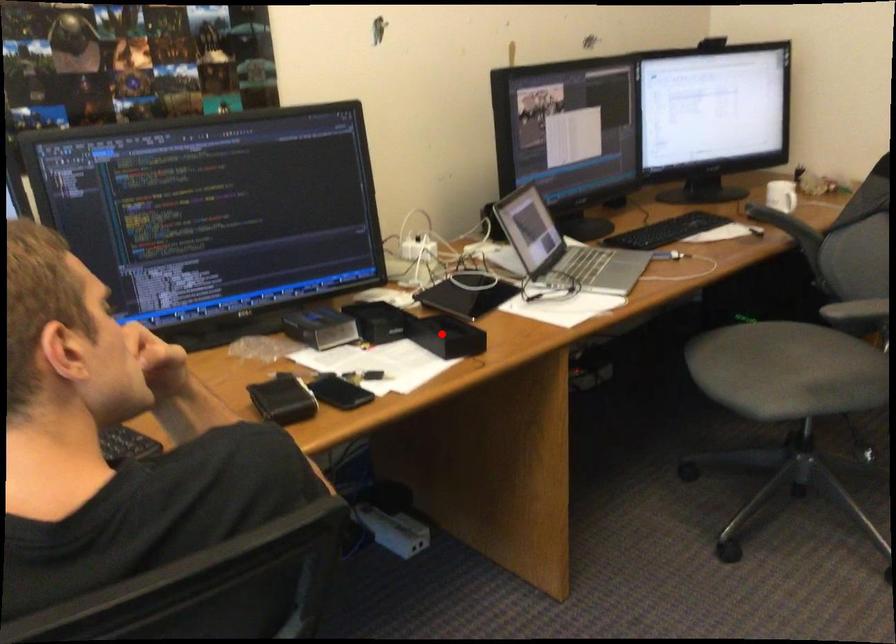
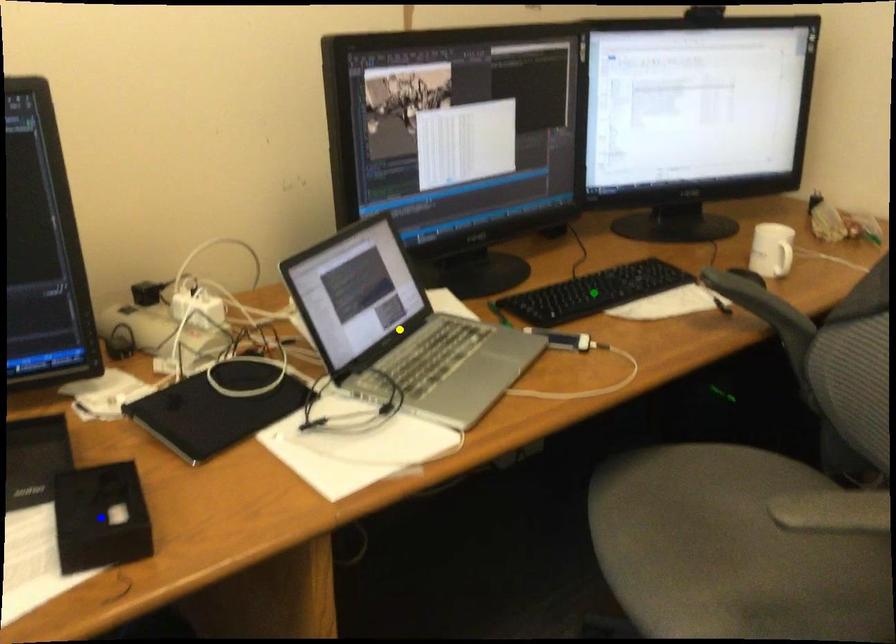
Question: I am providing you with two images of the same scene from different viewpoints. A red point is marked on the first image. You are given multiple points on the second image. Can you choose the point in image 2 that corresponds to the point in image 1?

Choices:
 (A) blue point
 (B) green point
 (C) yellow point

Answer: (A)